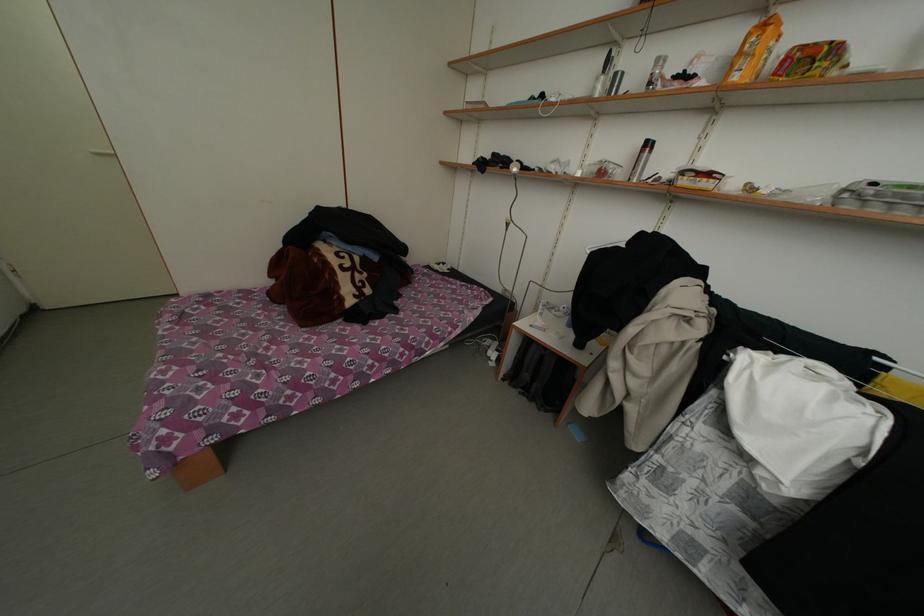
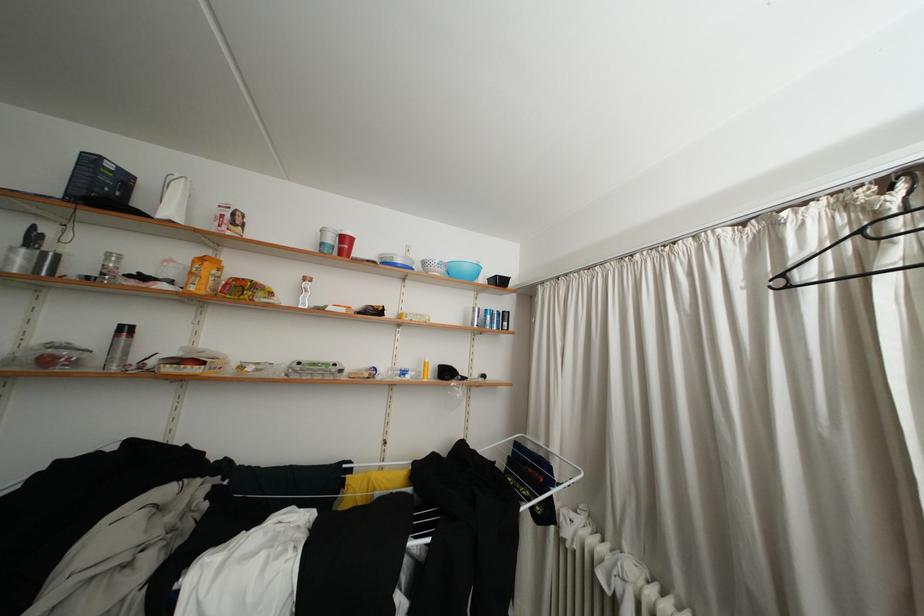
In the second image, find the point that corresponds to (x=654, y=147) in the first image.

(129, 331)